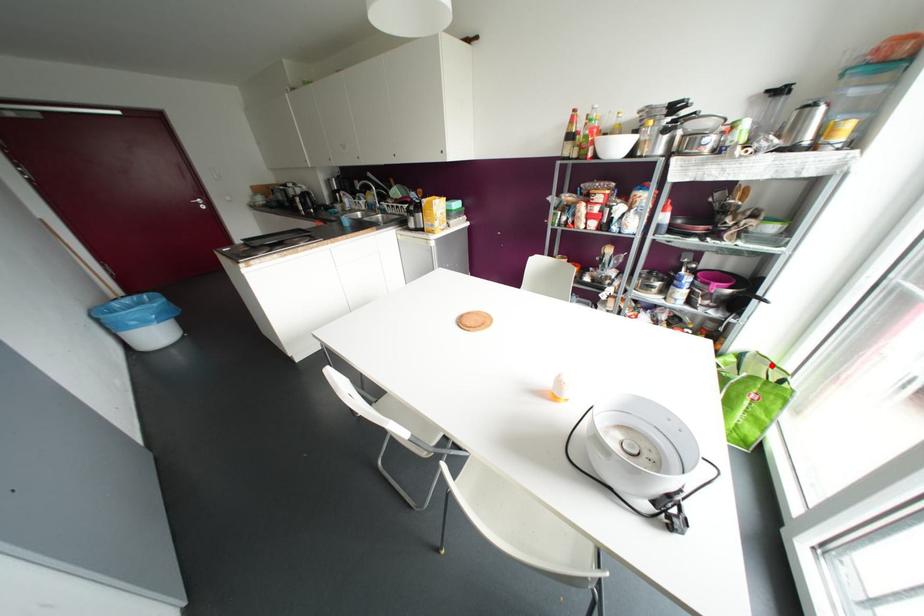
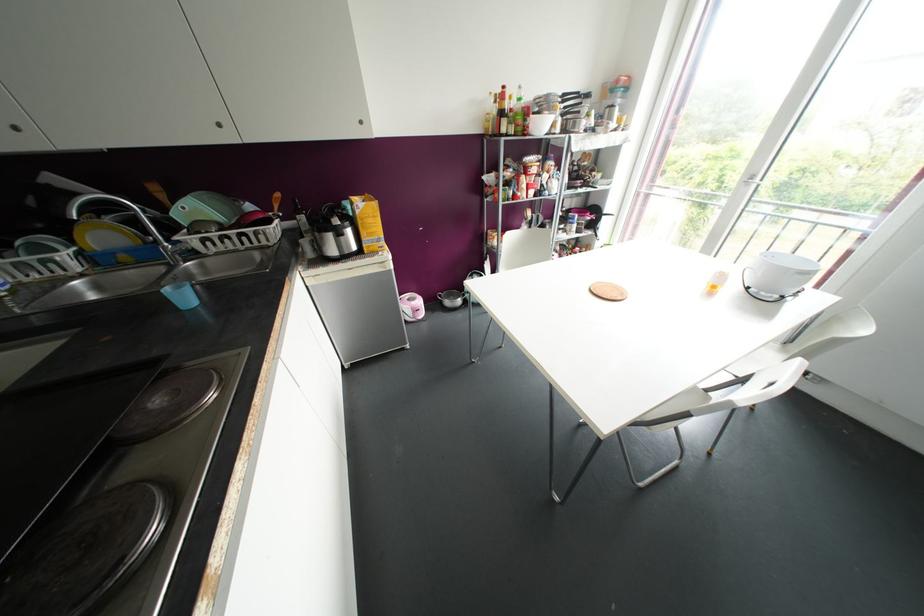
Question: I am providing you with two images of the same scene from different viewpoints. A red point is marked on the first image. At the location where the point appears in image 1, is it still visible in image 2?

Choices:
 (A) Yes
 (B) No

Answer: (B)